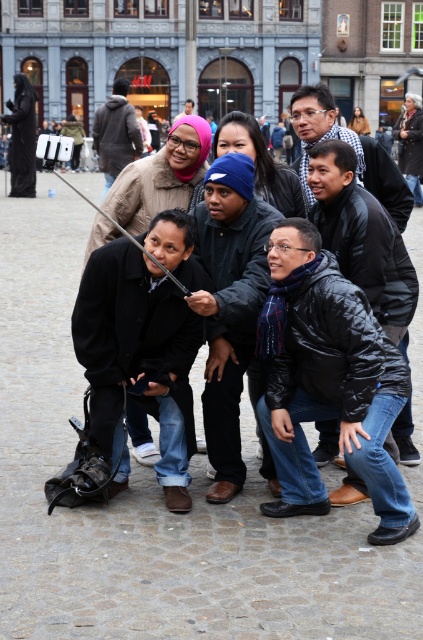
Based on the photo, is the position of blue knit cap at center more distant than that of metallic silver pole at center?

No, it is in front of metallic silver pole at center.

Who is more forward, (241, 294) or (142, 248)?

Positioned in front is point (142, 248).

Is point (219, 257) closer to camera compared to point (117, 225)?

No, it is behind (117, 225).

Identify the location of blue knit cap at center. This screenshot has height=640, width=423. (230, 305).

Consider the image. Is light brown leather jacket at center wider than metallic silver pole at center?

In fact, light brown leather jacket at center might be narrower than metallic silver pole at center.

Which is behind, point (115, 138) or point (104, 212)?

The point (115, 138) is behind.

Does point (120, 109) lie in front of point (52, 170)?

Yes, point (120, 109) is in front of point (52, 170).

This screenshot has width=423, height=640. I want to click on light brown leather jacket at center, so click(115, 132).

Can you confirm if black quilted jacket at center is positioned below matte black jacket at upper center?

Indeed, black quilted jacket at center is positioned under matte black jacket at upper center.

Who is higher up, black quilted jacket at center or matte black jacket at upper center?

matte black jacket at upper center is above.

Is point (335, 186) positioned after point (392, 186)?

No, (335, 186) is in front of (392, 186).

The width and height of the screenshot is (423, 640). Identify the location of black quilted jacket at center. [x=362, y=236].